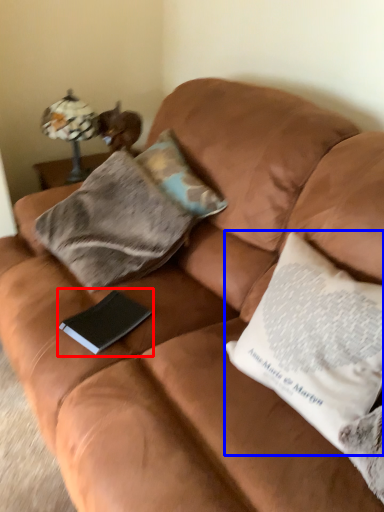
Question: Among these objects, which one is nearest to the camera, paperback book (highlighted by a red box) or pillow (highlighted by a blue box)?

Choices:
 (A) paperback book
 (B) pillow

Answer: (B)